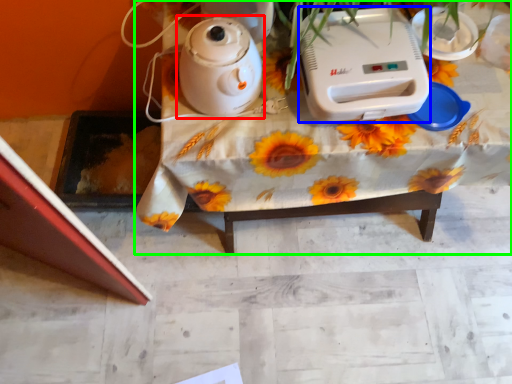
Question: Considering the real-world distances, which object is closest to kettle (highlighted by a red box)? appliance (highlighted by a blue box) or table (highlighted by a green box).

Choices:
 (A) appliance
 (B) table

Answer: (B)